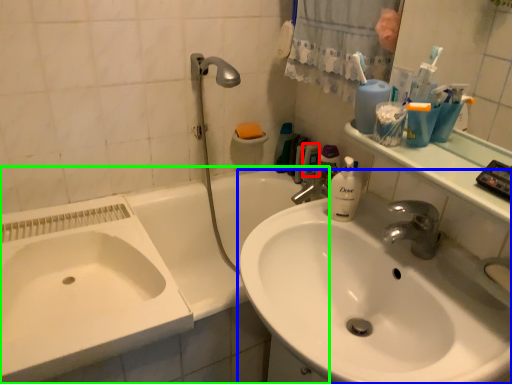
Question: Based on their relative distances, which object is nearer to mouthwash (highlighted by a red box)? Choose from sink (highlighted by a blue box) and bathtub (highlighted by a green box).

Choices:
 (A) sink
 (B) bathtub

Answer: (B)